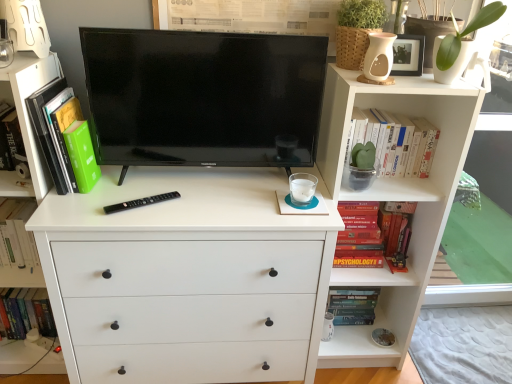
Where is `free space above hardcover books at upper right, which is counted as the 5th book, starting from the left (from a real-world perspective)`? Image resolution: width=512 pixels, height=384 pixels. free space above hardcover books at upper right, which is counted as the 5th book, starting from the left (from a real-world perspective) is located at coordinates (385, 103).